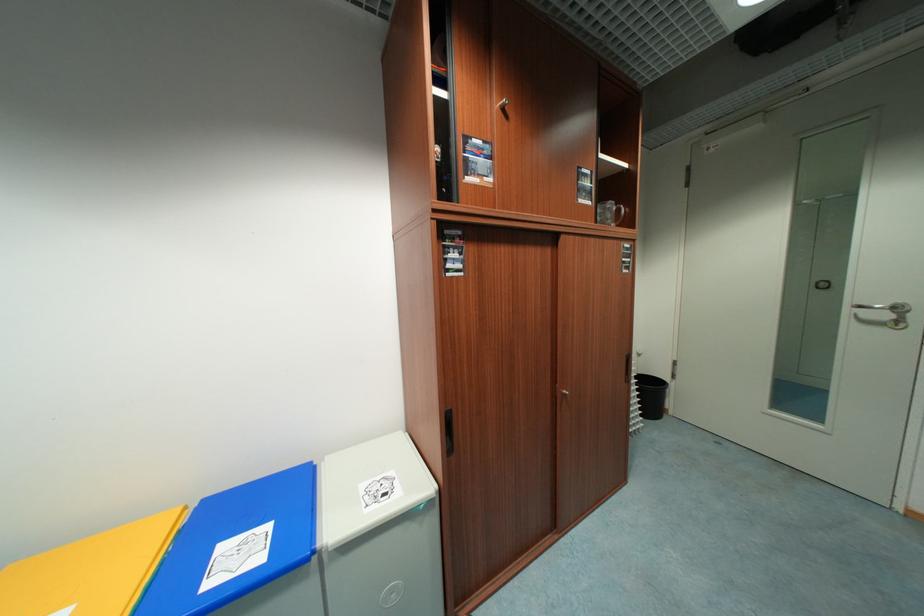
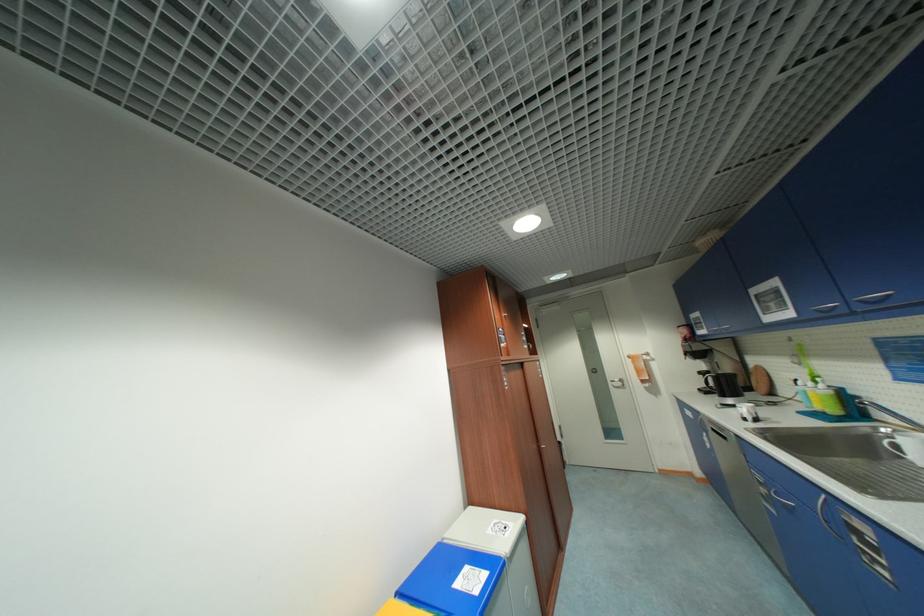
Locate, in the second image, the point that corresponds to pixel 211 588 in the first image.

(482, 593)